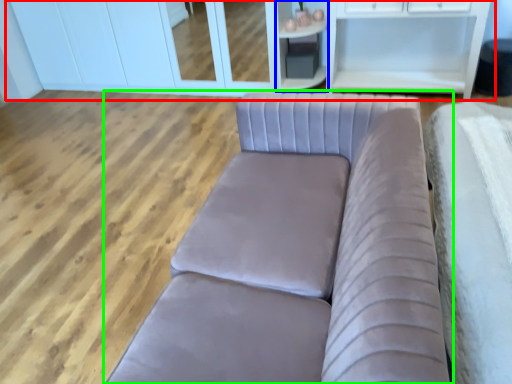
Question: Considering the real-world distances, which object is closest to dresser (highlighted by a red box)? cabinetry (highlighted by a blue box) or studio couch (highlighted by a green box).

Choices:
 (A) cabinetry
 (B) studio couch

Answer: (A)